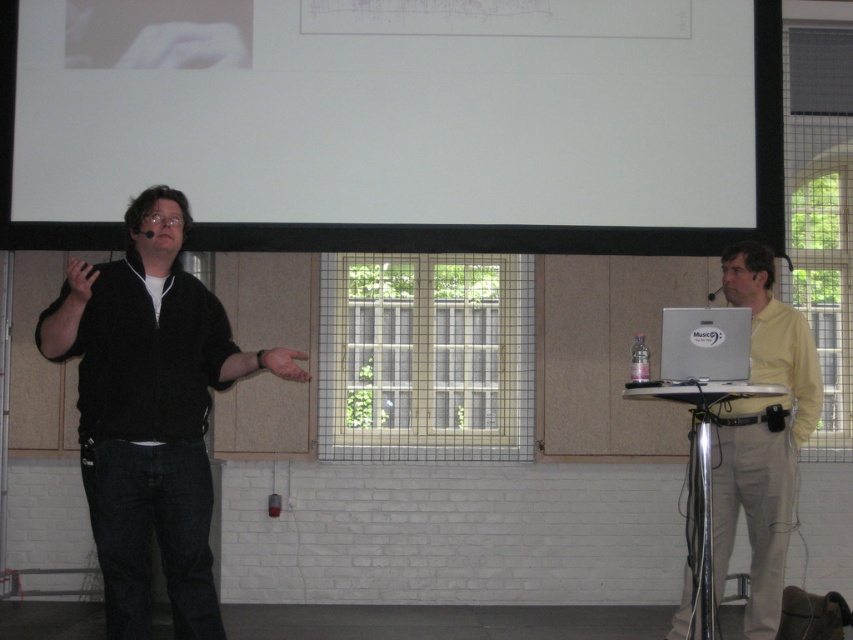
You are an event organizer who needs to adjust the seating arrangement for the presenter and the audience. The yellow smooth shirt at right and the silver metallic computer at right are both in the same area. Which one should you move to make more space for the audience? Explain your reasoning.

The yellow smooth shirt at right is much taller than the silver metallic computer at right, so moving the yellow smooth shirt at right would create more vertical space, allowing the audience to have a better view.

You are attending a virtual meeting and see the black matte jacket at left and the yellow smooth shirt at right. Which one is positioned higher in the image?

The black matte jacket at left is positioned higher in the image than the yellow smooth shirt at right.

Based on the photo, you are standing in the room and want to reach the point marked at coordinates (814, 364). If your walking speed is 1.2 meters per second, how many seconds will it take you to reach that point?

The point marked at coordinates (814, 364) is 5.82 meters away from you. At a walking speed of 1.2 meters per second, it will take approximately 4.85 seconds to reach that point.